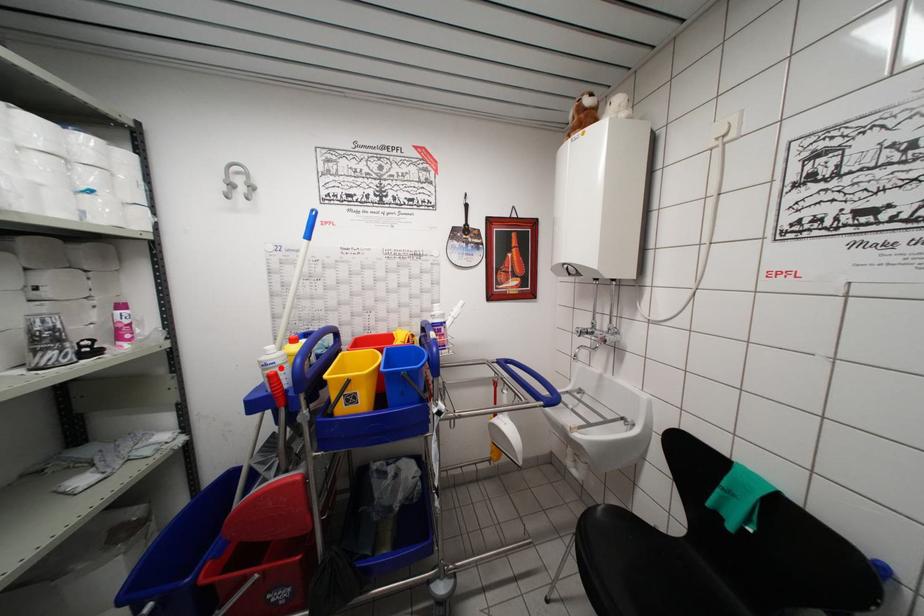
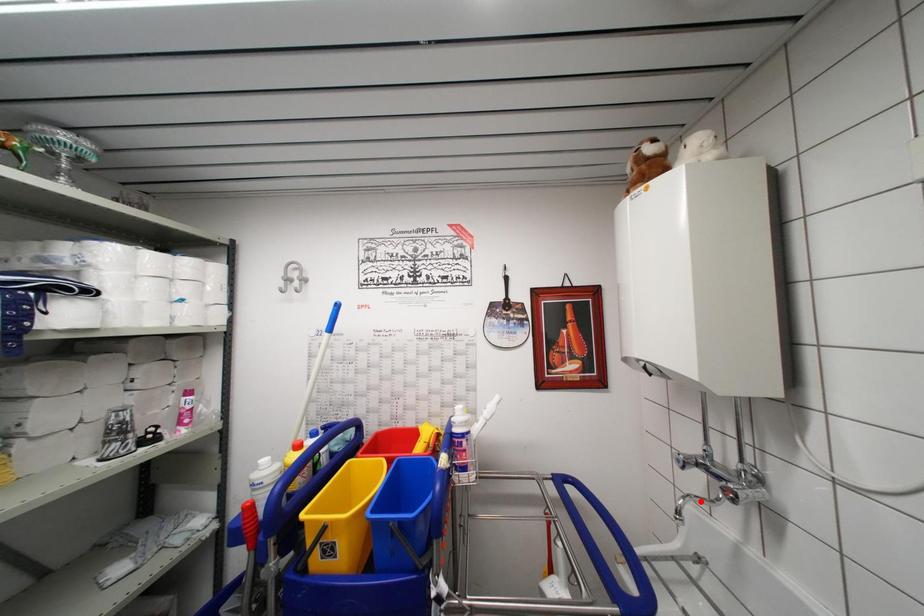
I am providing you with two images of the same scene from different viewpoints. A red point is marked on the first image and another point is marked on the second image. Is the red point in image1 aligned with the point shown in image2?

No